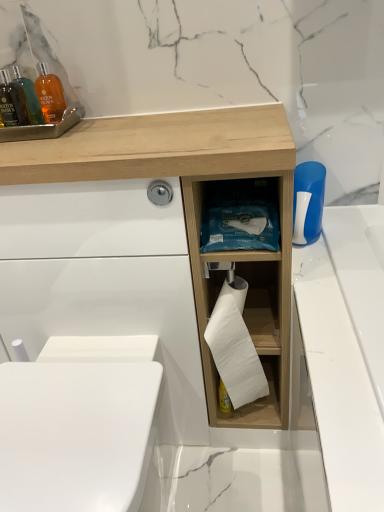
You are a GUI agent. You are given a task and a screenshot of the screen. Output one action in this format:
    pyautogui.click(x=<x>, y=<y>)
    Task: Click on the free space on the front side of translucent orange bottle at upper left, marked as the 1th mouthwash in a back-to-front arrangement
    The image size is (384, 512).
    Given the screenshot: What is the action you would take?
    pyautogui.click(x=45, y=143)